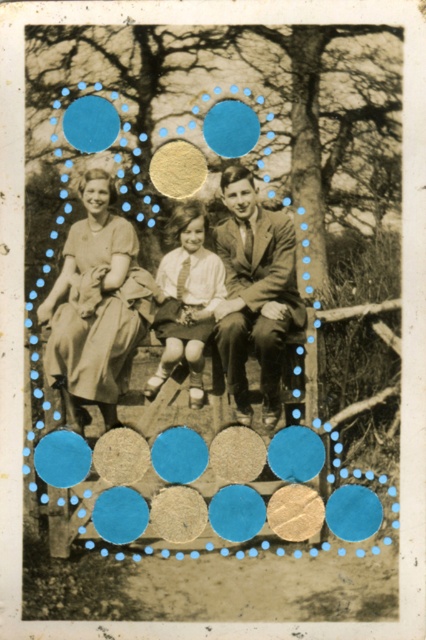
You are a photographer analyzing the vintage image. You notice the matte white shirt at center and the matte yellow circle at center. Which object is positioned in front of the other?

The matte white shirt at center is closer to the viewer than the matte yellow circle at center, so it is positioned in front of it.

You are a photographer analyzing this vintage photo. You notice the matte brown suit at center and the light beige dress at left. Based on the spatial arrangement, which object is positioned to the right of the other?

The matte brown suit at center is to the right of the light beige dress at left.